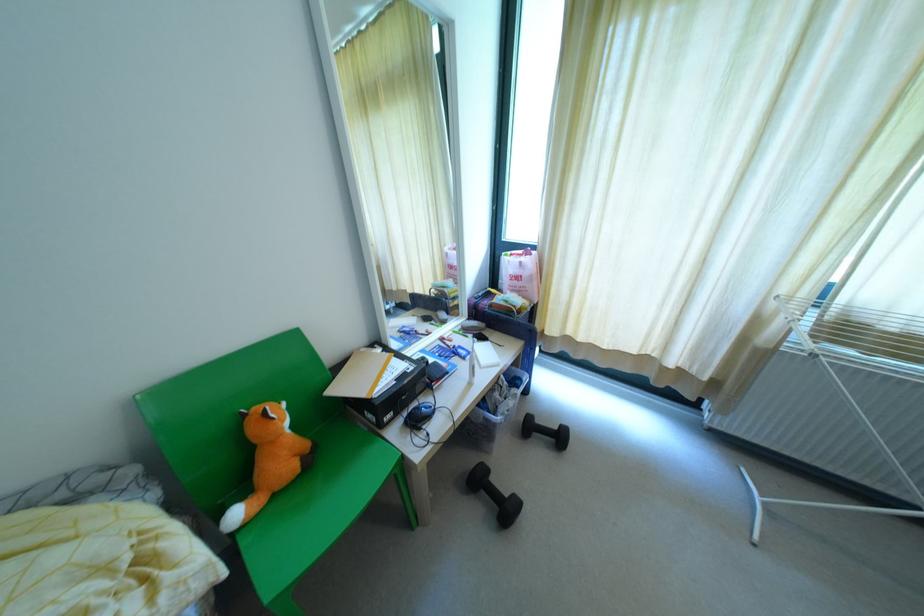
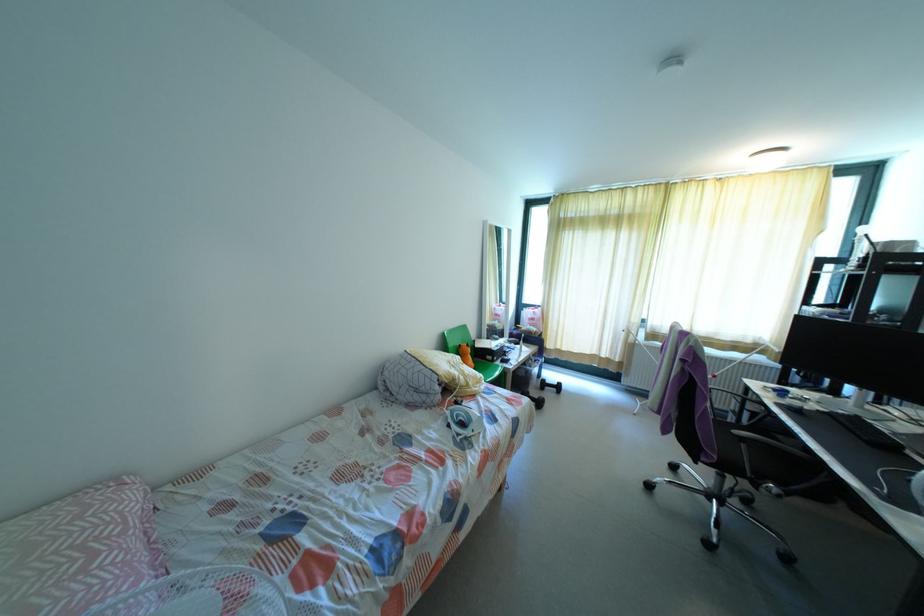
Find the pixel in the second image that matches [517,277] in the first image.

(531, 318)